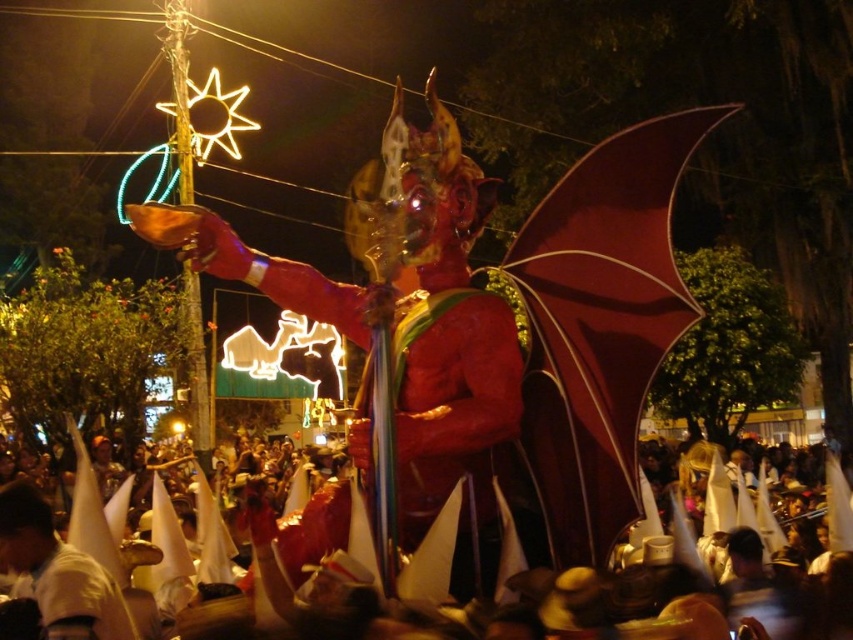
You are standing at the origin point in the image. There are two points marked in the scene. The first is at coordinate point [252,502] and the second is at point [39,509]. If you were to walk towards the first point, would you pass the second point before reaching it?

Yes, because point [252,502] is behind point [39,509], so walking towards the first point would require passing the second point first.

You are a photographer trying to capture the devil figure in the foreground while also including the crowd. You notice the white paper hats at center and the white matte cone at lower left in your frame. Which object should you adjust your camera angle to prioritize if you want to ensure both the devil figure and the crowd are visible?

Since the white paper hats at center are above the white matte cone at lower left, adjusting the camera angle to focus on the white paper hats at center would allow you to include both the devil figure in the foreground and the crowd below, ensuring visibility of both elements.